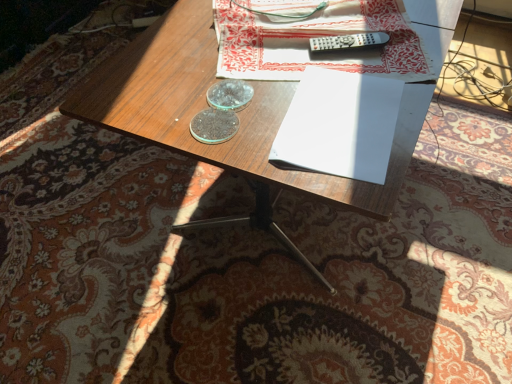
At what (x,y) coordinates should I click in order to perform the action: click on free space to the left of black plastic remote at upper center. Please return your answer as a coordinate pair (x, y). Looking at the image, I should click on [x=279, y=61].